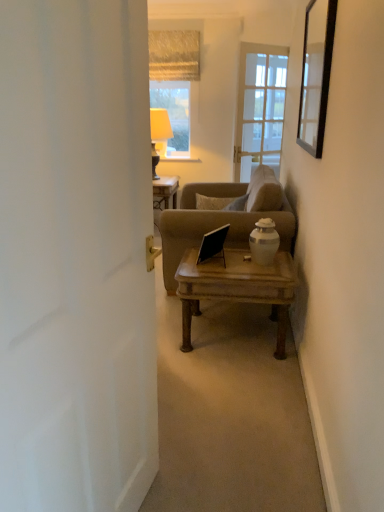
Question: From the image's perspective, is white matte door at left positioned above or below wooden coffee table at center?

Choices:
 (A) above
 (B) below

Answer: (A)

Question: Is white matte door at left bigger or smaller than wooden coffee table at center?

Choices:
 (A) big
 (B) small

Answer: (A)

Question: Considering the real-world distances, which object is closest to the black matte laptop at center?

Choices:
 (A) black glass mirror at upper right
 (B) wooden coffee table at center
 (C) textured beige curtain at upper center
 (D) white matte door at left
 (E) matte beige lampshade at upper center

Answer: (B)

Question: Which object is the closest to the matte beige lampshade at upper center?

Choices:
 (A) wooden coffee table at center
 (B) black glass mirror at upper right
 (C) textured beige curtain at upper center
 (D) white matte door at left
 (E) black matte laptop at center

Answer: (C)